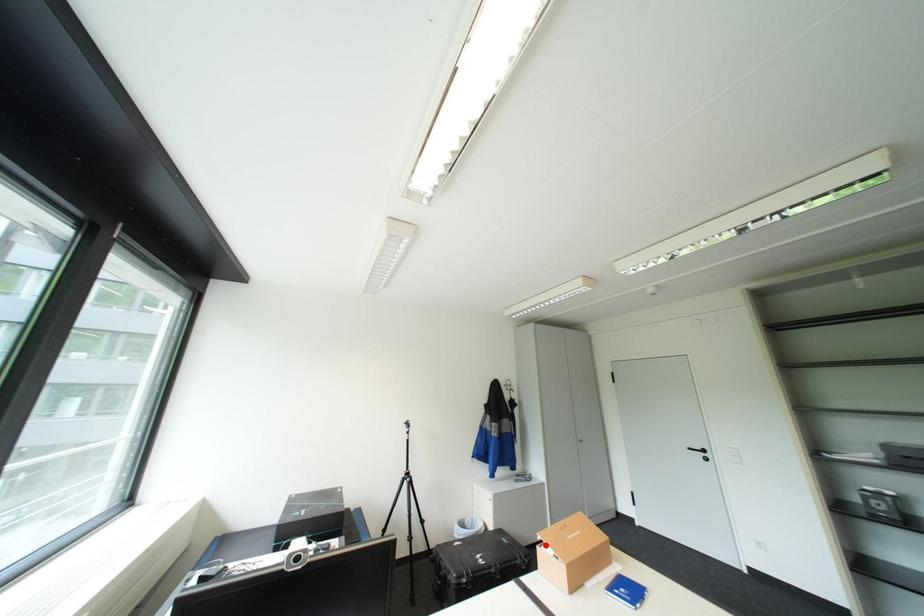
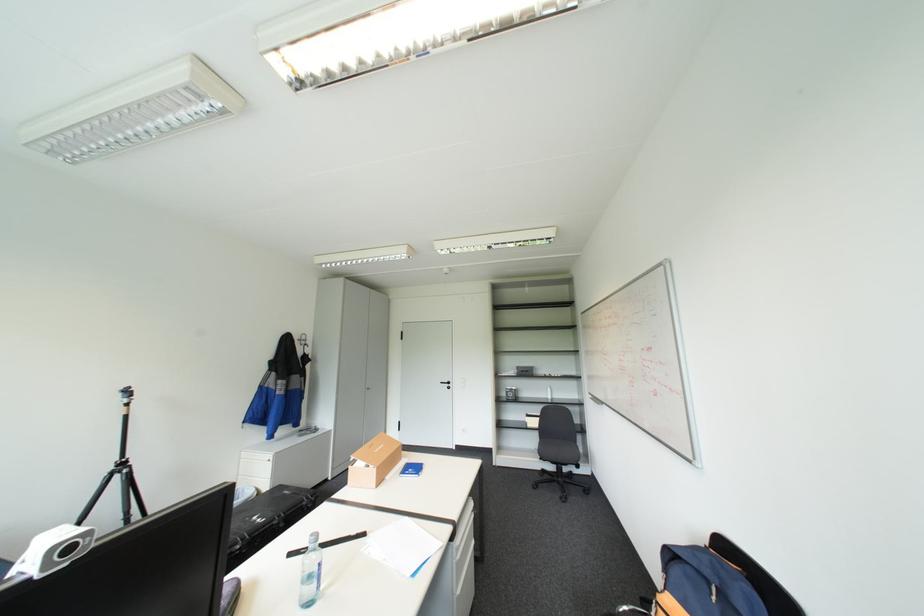
The point at the highlighted location is marked in the first image. Where is the corresponding point in the second image?

(358, 464)